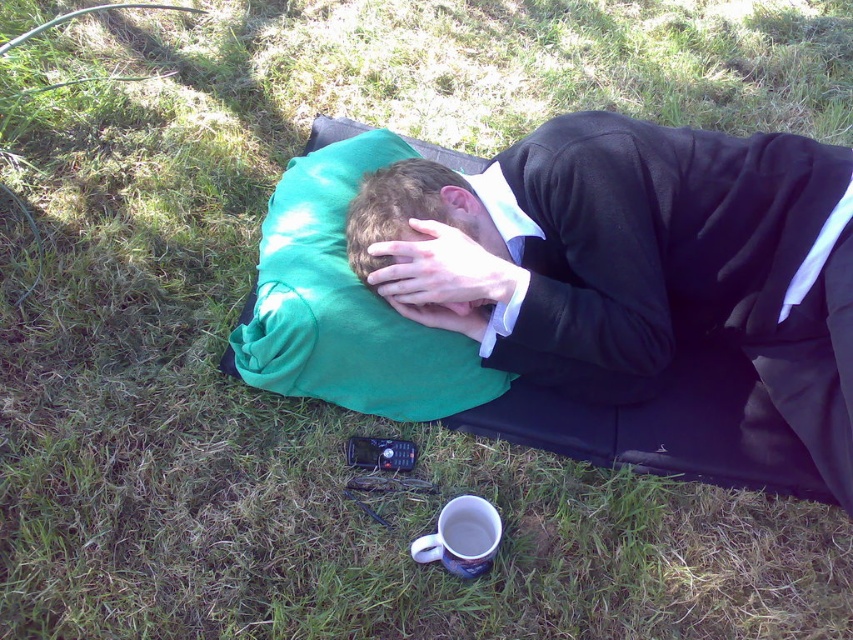
Question: Considering the relative positions of matte black jacket at center and white ceramic mug at lower center in the image provided, where is matte black jacket at center located with respect to white ceramic mug at lower center?

Choices:
 (A) right
 (B) left

Answer: (A)

Question: Which point appears farthest from the camera in this image?

Choices:
 (A) (480, 506)
 (B) (494, 234)
 (C) (331, 264)
 (D) (410, 193)

Answer: (C)

Question: Among these points, which one is nearest to the camera?

Choices:
 (A) (297, 346)
 (B) (718, 257)
 (C) (427, 192)
 (D) (426, 557)

Answer: (D)

Question: From the image, what is the correct spatial relationship of green fabric pillow at center in relation to white ceramic mug at lower center?

Choices:
 (A) below
 (B) above

Answer: (B)

Question: Is matte black jacket at center positioned in front of green fabric pillow at center?

Choices:
 (A) no
 (B) yes

Answer: (B)

Question: Which point is farther to the camera?

Choices:
 (A) matte black jacket at center
 (B) green fabric pillow at center
 (C) matte green pillow at center

Answer: (B)